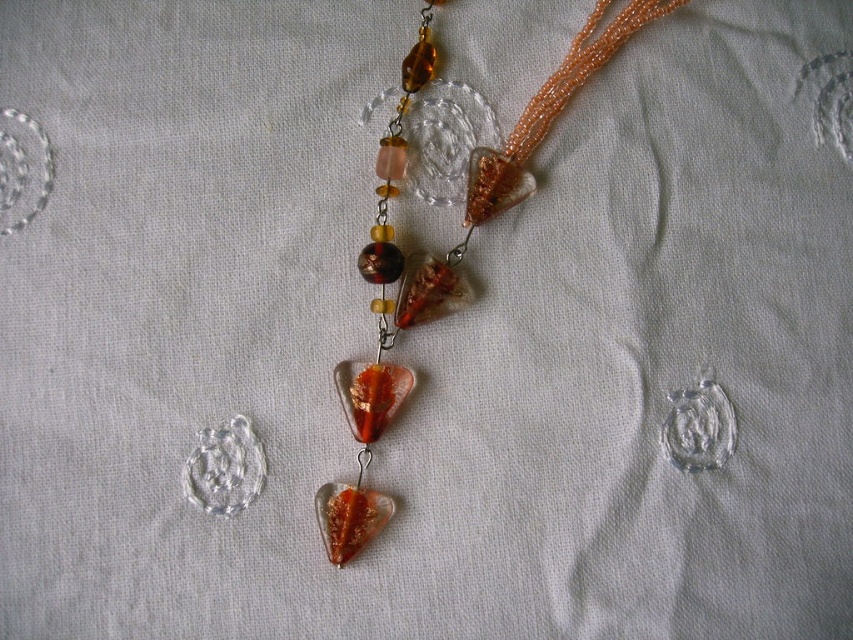
You are a jeweler who needs to ensure the necklace fits into a display case that measures 2 inches in length. Given the distance between the translucent amber glass pendant at center and the translucent amber glass heart at center, will the necklace fit comfortably in the case?

The distance between the translucent amber glass pendant at center and the translucent amber glass heart at center is 1.76 inches, which is less than the 2 inches available in the display case. Therefore, the necklace will fit comfortably in the case.

You are examining the necklace from above. There are two points marked on the necklace string at coordinates point (393,147) and point (357,452). Which point is closer to you?

Point (357,452) is closer to you because point (393,147) is behind it.